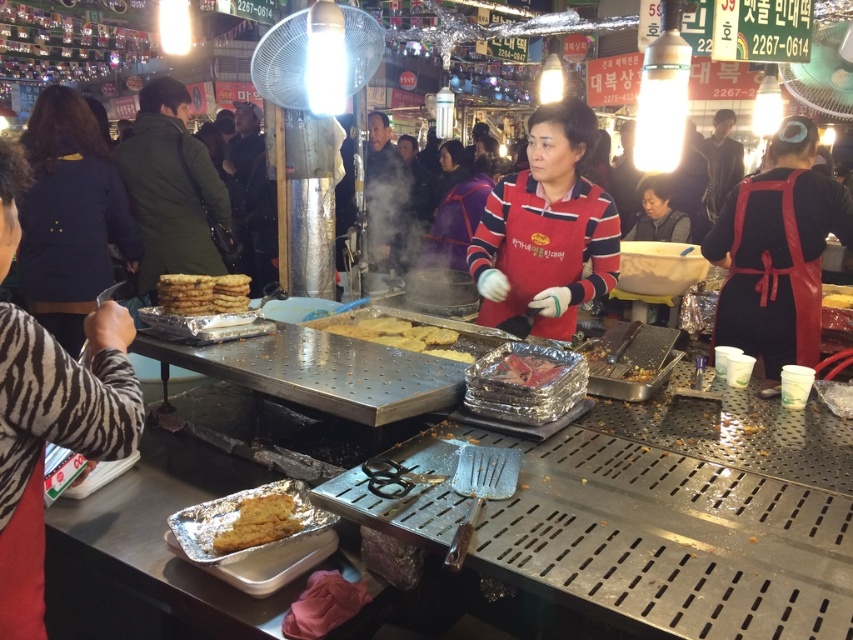
Can you confirm if golden crispy pancake at center is bigger than shiny metallic foil at center?

Indeed, golden crispy pancake at center has a larger size compared to shiny metallic foil at center.

Measure the distance between golden crispy pancake at center and camera.

golden crispy pancake at center and camera are 6.46 feet apart.

Find the location of a particular element. This screenshot has height=640, width=853. golden crispy pancake at center is located at coordinates (396, 333).

Which is more to the left, golden crispy pastry at center or shiny metallic foil at center?

golden crispy pastry at center

How far apart are golden crispy pastry at center and shiny metallic foil at center?

golden crispy pastry at center and shiny metallic foil at center are 35.45 inches apart from each other.

At what (x,y) coordinates should I click in order to perform the action: click on golden crispy pastry at center. Please return your answer as a coordinate pair (x, y). Looking at the image, I should click on (202, 292).

How far apart are dark blue fabric jacket at left and shiny metallic foil at center?

dark blue fabric jacket at left and shiny metallic foil at center are 2.49 meters apart.

Between point (26, 273) and point (543, 378), which one is positioned behind?

Positioned behind is point (26, 273).

The height and width of the screenshot is (640, 853). In order to click on dark blue fabric jacket at left in this screenshot , I will do `click(68, 216)`.